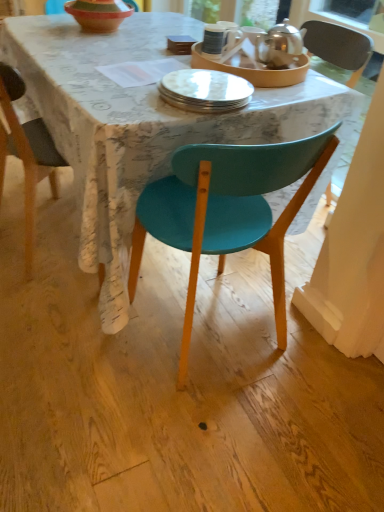
Question: Is matte teal chair at center smaller than matte white plate at center, which ranks as the second tableware in right-to-left order?

Choices:
 (A) no
 (B) yes

Answer: (A)

Question: Can you confirm if matte teal chair at center is taller than matte white plate at center, which is counted as the first tableware, starting from the left?

Choices:
 (A) yes
 (B) no

Answer: (A)

Question: Would you say matte white plate at center, which ranks as the second tableware in right-to-left order, is part of matte teal chair at center's contents?

Choices:
 (A) no
 (B) yes

Answer: (B)

Question: Is matte teal chair at center outside of matte white plate at center, which is counted as the first tableware, starting from the left?

Choices:
 (A) no
 (B) yes

Answer: (B)

Question: Are matte teal chair at center and matte white plate at center, which is counted as the first tableware, starting from the left, located far from each other?

Choices:
 (A) yes
 (B) no

Answer: (B)

Question: In the image, is matte white plate at center, which ranks as the second tableware in right-to-left order, on the left side or the right side of white glossy plate at center?

Choices:
 (A) right
 (B) left

Answer: (A)

Question: Does point (274, 71) appear closer or farther from the camera than point (187, 100)?

Choices:
 (A) farther
 (B) closer

Answer: (A)

Question: Is matte white plate at center, which ranks as the second tableware in right-to-left order, taller or shorter than white glossy plate at center?

Choices:
 (A) short
 (B) tall

Answer: (B)

Question: Looking at the image, does matte white plate at center, which is counted as the first tableware, starting from the left, seem bigger or smaller compared to white glossy plate at center?

Choices:
 (A) big
 (B) small

Answer: (A)

Question: Is matte white plate at center, which is counted as the first tableware, starting from the left, in front of or behind teal plastic chair at center in the image?

Choices:
 (A) front
 (B) behind

Answer: (B)

Question: Considering the positions of matte white plate at center, which ranks as the second tableware in right-to-left order, and teal plastic chair at center in the image, is matte white plate at center, which ranks as the second tableware in right-to-left order, wider or thinner than teal plastic chair at center?

Choices:
 (A) thin
 (B) wide

Answer: (A)

Question: From a real-world perspective, is matte white plate at center, which is counted as the first tableware, starting from the left, positioned above or below teal plastic chair at center?

Choices:
 (A) below
 (B) above

Answer: (B)

Question: In terms of size, does matte white plate at center, which ranks as the second tableware in right-to-left order, appear bigger or smaller than teal plastic chair at center?

Choices:
 (A) big
 (B) small

Answer: (B)

Question: Considering the positions of matte white plate at center, which is counted as the first tableware, starting from the left, and terracotta clay bowl at upper center in the image, is matte white plate at center, which is counted as the first tableware, starting from the left, bigger or smaller than terracotta clay bowl at upper center?

Choices:
 (A) big
 (B) small

Answer: (A)

Question: From a real-world perspective, is matte white plate at center, which is counted as the first tableware, starting from the left, above or below terracotta clay bowl at upper center?

Choices:
 (A) above
 (B) below

Answer: (B)